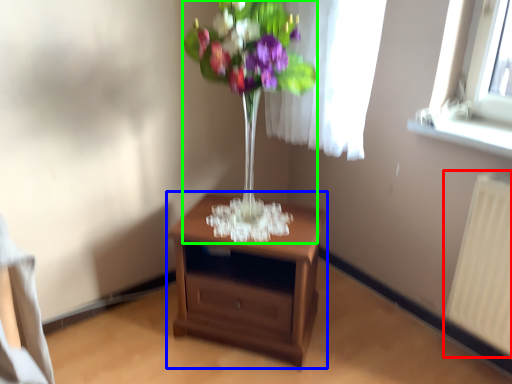
Question: Based on their relative distances, which object is farther from radiator (highlighted by a red box)? Choose from nightstand (highlighted by a blue box) and floral arrangement (highlighted by a green box).

Choices:
 (A) nightstand
 (B) floral arrangement

Answer: (B)